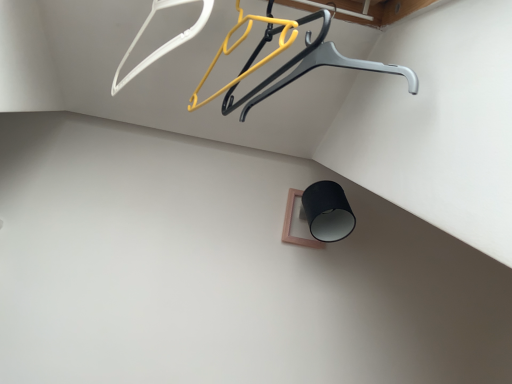
Question: Is white plastic hanger at upper left, the second hanger from the right, thinner than metallic gray hanger at upper center?

Choices:
 (A) no
 (B) yes

Answer: (B)

Question: Is white plastic hanger at upper left, which appears as the first hanger when viewed from the left, looking in the opposite direction of metallic gray hanger at upper center?

Choices:
 (A) no
 (B) yes

Answer: (A)

Question: Is white plastic hanger at upper left, which appears as the first hanger when viewed from the left, at the right side of metallic gray hanger at upper center?

Choices:
 (A) yes
 (B) no

Answer: (B)

Question: Is white plastic hanger at upper left, the second hanger from the right, oriented towards metallic gray hanger at upper center?

Choices:
 (A) no
 (B) yes

Answer: (A)

Question: From the image's perspective, is white plastic hanger at upper left, the second hanger from the right, above metallic gray hanger at upper center?

Choices:
 (A) no
 (B) yes

Answer: (B)

Question: Is white plastic hanger at upper left, which appears as the first hanger when viewed from the left, in front of or behind yellow plastic hanger at upper center, arranged as the second hanger when viewed from the left, in the image?

Choices:
 (A) behind
 (B) front

Answer: (A)

Question: Would you say white plastic hanger at upper left, which appears as the first hanger when viewed from the left, is to the left or to the right of yellow plastic hanger at upper center, arranged as the second hanger when viewed from the left, in the picture?

Choices:
 (A) left
 (B) right

Answer: (A)

Question: Is white plastic hanger at upper left, which appears as the first hanger when viewed from the left, bigger or smaller than yellow plastic hanger at upper center, arranged as the second hanger when viewed from the left?

Choices:
 (A) small
 (B) big

Answer: (B)

Question: From the image's perspective, relative to yellow plastic hanger at upper center, arranged as the second hanger when viewed from the left, is white plastic hanger at upper left, which appears as the first hanger when viewed from the left, above or below?

Choices:
 (A) below
 (B) above

Answer: (B)

Question: Would you say white plastic hanger at upper left, which appears as the first hanger when viewed from the left, is to the left or to the right of metallic gray hanger at upper center in the picture?

Choices:
 (A) right
 (B) left

Answer: (B)

Question: Does point (126, 54) appear closer or farther from the camera than point (248, 64)?

Choices:
 (A) farther
 (B) closer

Answer: (A)

Question: From the image's perspective, is white plastic hanger at upper left, which appears as the first hanger when viewed from the left, located above or below metallic gray hanger at upper center?

Choices:
 (A) below
 (B) above

Answer: (B)

Question: From a real-world perspective, is white plastic hanger at upper left, which appears as the first hanger when viewed from the left, above or below metallic gray hanger at upper center?

Choices:
 (A) above
 (B) below

Answer: (A)

Question: From the image's perspective, is metallic gray hanger at upper center located above or below white plastic hanger at upper left, which appears as the first hanger when viewed from the left?

Choices:
 (A) below
 (B) above

Answer: (A)

Question: Based on their sizes in the image, would you say metallic gray hanger at upper center is bigger or smaller than white plastic hanger at upper left, the second hanger from the right?

Choices:
 (A) big
 (B) small

Answer: (A)